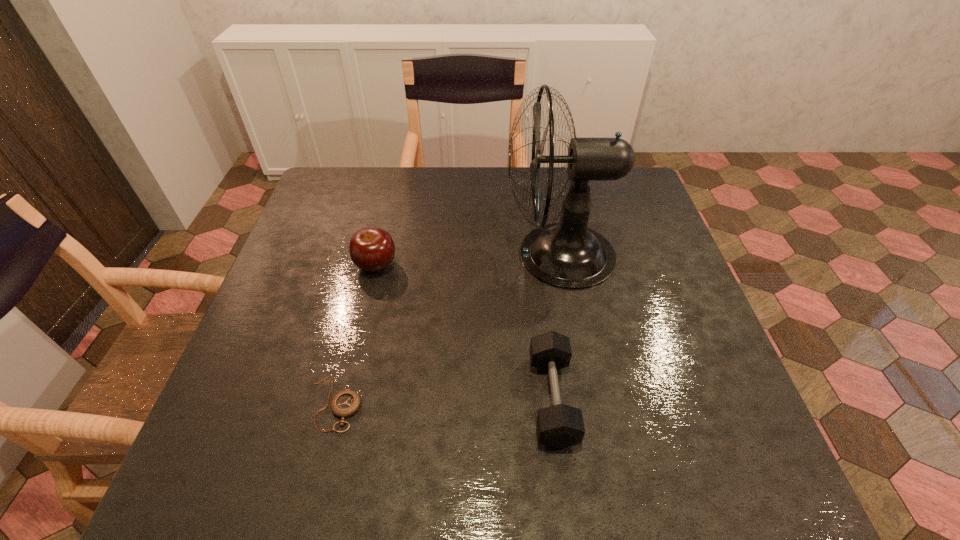
In order to click on object present at the near edge in this screenshot , I will do `click(559, 426)`.

Where is `object that is at the right edge`? object that is at the right edge is located at coordinates (569, 255).

In the image, there is a desktop. What are the coordinates of `vacant space at the far edge` in the screenshot? It's located at (378, 210).

Locate an element on the screen. vacant region at the near edge of the desktop is located at coordinates (483, 469).

The height and width of the screenshot is (540, 960). In order to click on free space at the left edge of the desktop in this screenshot , I will do `click(336, 267)`.

Find the location of a particular element. The image size is (960, 540). vacant space at the right edge of the desktop is located at coordinates (690, 350).

The width and height of the screenshot is (960, 540). In the image, there is a desktop. Find the location of `vacant region at the far left corner`. vacant region at the far left corner is located at coordinates (326, 171).

In the image, there is a desktop. Where is `vacant space at the far right corner`? The height and width of the screenshot is (540, 960). vacant space at the far right corner is located at coordinates (634, 211).

Where is `unoccupied area between the dumbbell and the apple`? The height and width of the screenshot is (540, 960). unoccupied area between the dumbbell and the apple is located at coordinates (464, 332).

Locate an element on the screen. The image size is (960, 540). free point between the pocket watch and the third shortest object is located at coordinates (355, 335).